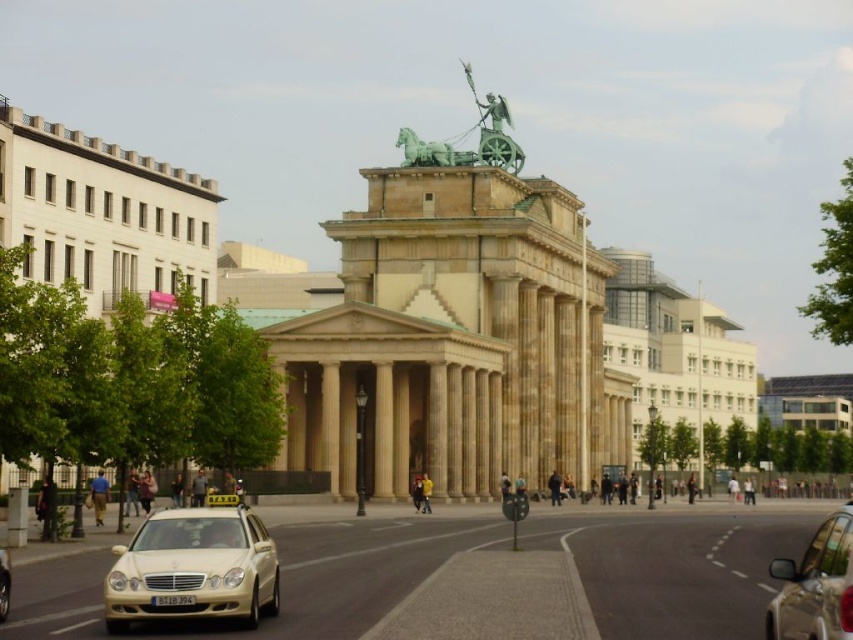
Is point (811, 545) positioned behind point (467, 156)?

No, it is not.

The height and width of the screenshot is (640, 853). What do you see at coordinates (815, 586) in the screenshot?
I see `metallic silver car at lower right` at bounding box center [815, 586].

Is point (848, 596) farther from viewer compared to point (438, 141)?

No.

This screenshot has height=640, width=853. I want to click on metallic silver car at lower right, so click(815, 586).

From the picture: Does metallic silver car at lower right have a greater width compared to green polished stone statue at upper center?

Indeed, metallic silver car at lower right has a greater width compared to green polished stone statue at upper center.

Does metallic silver car at lower right have a lesser width compared to green polished stone statue at upper center?

No, metallic silver car at lower right is not thinner than green polished stone statue at upper center.

Identify the location of metallic silver car at lower right. (815, 586).

Is white glossy taxi at lower left to the right of green polished stone statue at upper center from the viewer's perspective?

In fact, white glossy taxi at lower left is to the left of green polished stone statue at upper center.

Which is more to the left, white glossy taxi at lower left or green polished stone statue at upper center?

Positioned to the left is white glossy taxi at lower left.

Find the location of `white glossy taxi at lower left`. white glossy taxi at lower left is located at coordinates (193, 568).

Image resolution: width=853 pixels, height=640 pixels. Find the location of `white glossy taxi at lower left`. white glossy taxi at lower left is located at coordinates (193, 568).